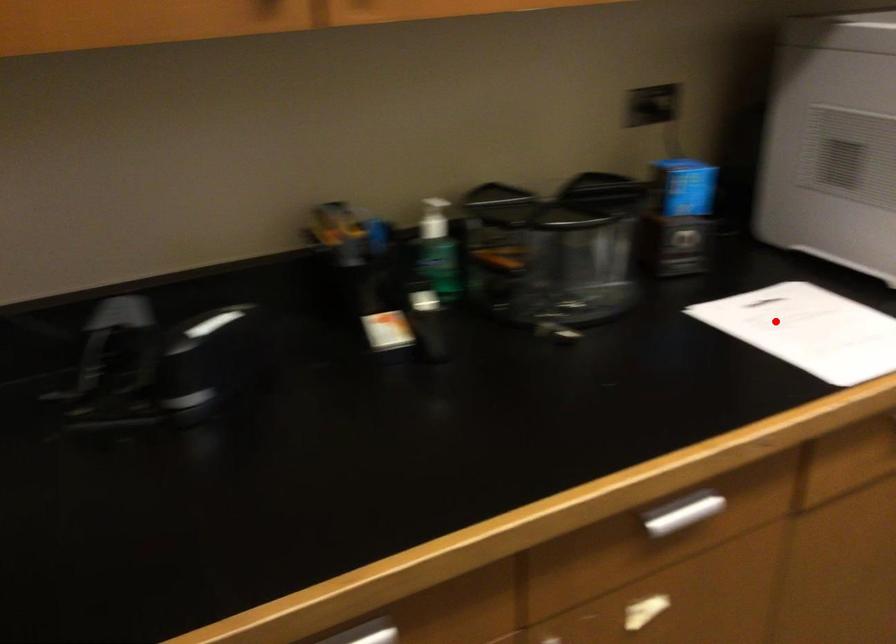
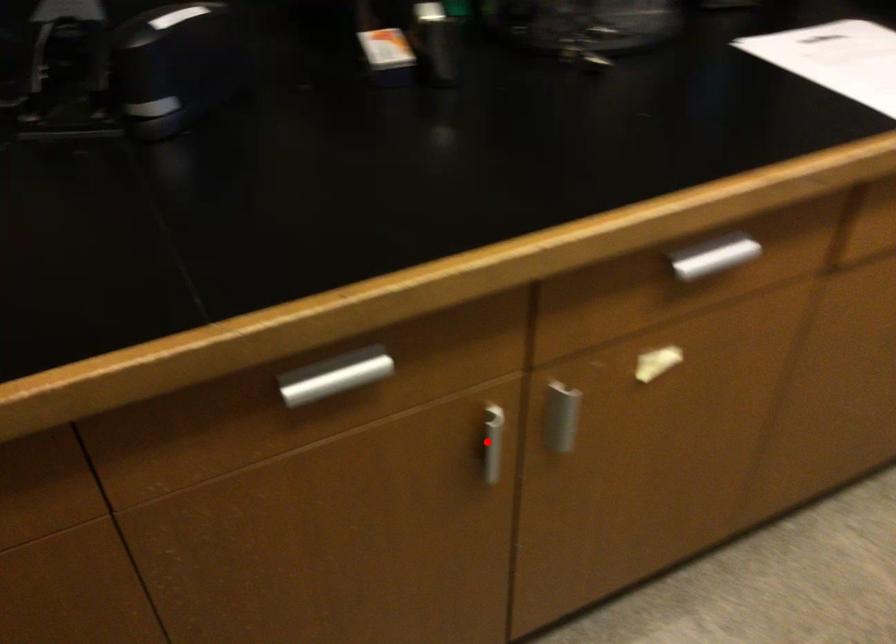
I am providing you with two images of the same scene from different viewpoints. A red point is marked on the first image and another point is marked on the second image. Are the points marked in image1 and image2 representing the same 3D position?

No